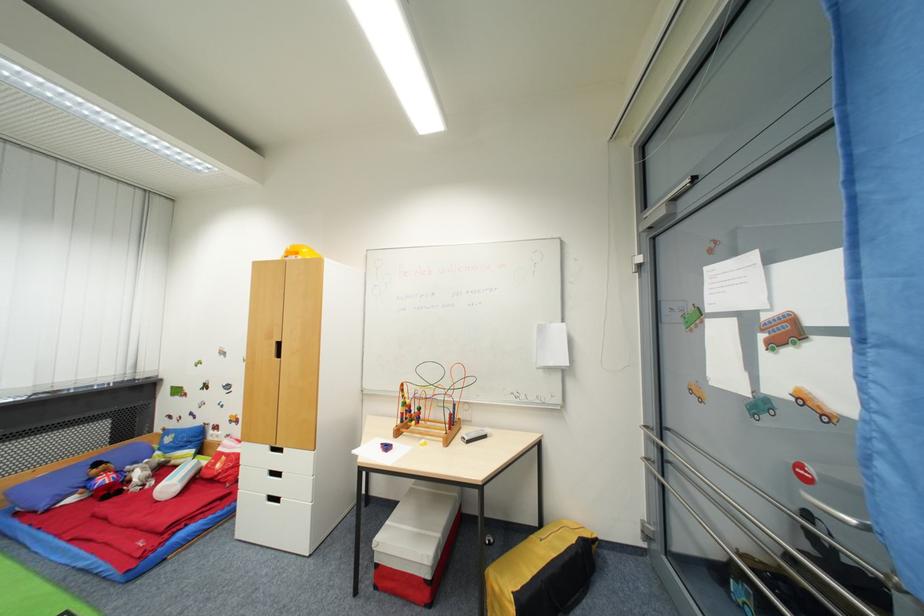
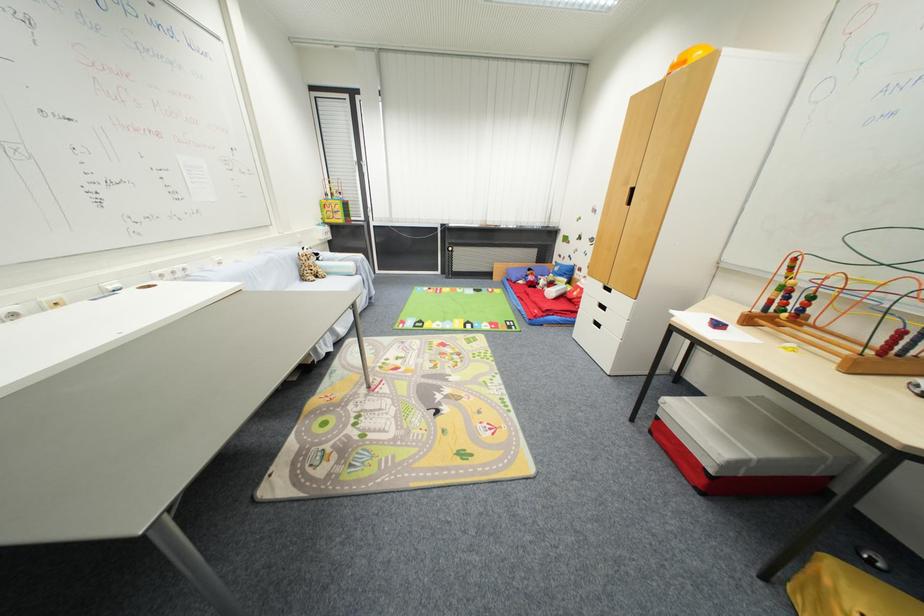
Where in the second image is the point corresponding to point (275, 339) from the first image?

(631, 185)